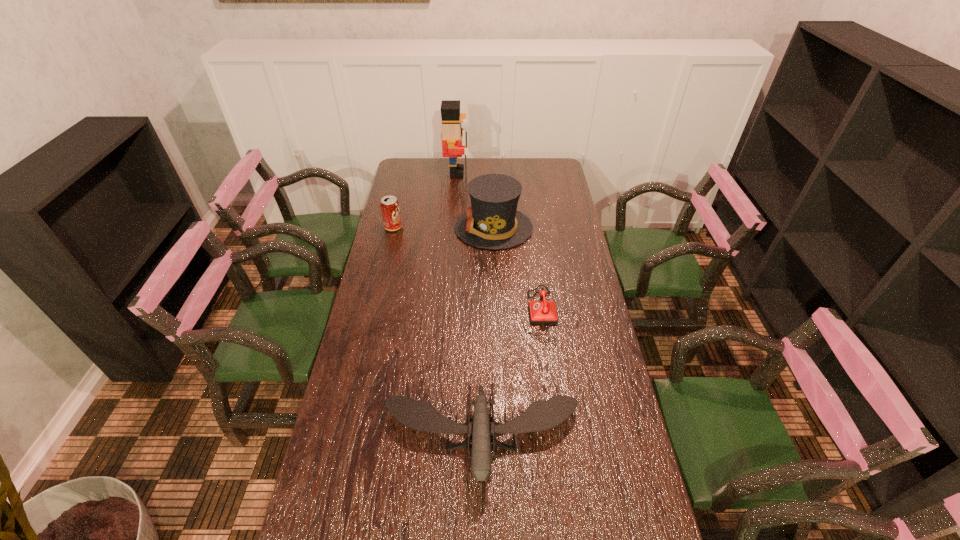
You are a GUI agent. You are given a task and a screenshot of the screen. Output one action in this format:
    pyautogui.click(x=<x>, y=<y>)
    Task: Click on the farthest object
    This screenshot has height=540, width=960.
    Given the screenshot: What is the action you would take?
    pyautogui.click(x=452, y=133)

Identify the location of the tallest object. (452, 133).

This screenshot has height=540, width=960. What are the coordinates of `the fourth shortest object` in the screenshot? It's located at (492, 222).

This screenshot has height=540, width=960. I want to click on the third shortest object, so click(x=390, y=209).

Find the location of a particular element. the leftmost object is located at coordinates (390, 209).

Where is `the nearest object`? the nearest object is located at coordinates (541, 415).

Identify the location of the second shortest object. The width and height of the screenshot is (960, 540). (541, 415).

Where is `telephone`? This screenshot has height=540, width=960. telephone is located at coordinates (541, 312).

Where is `the fourth farthest object`? Image resolution: width=960 pixels, height=540 pixels. the fourth farthest object is located at coordinates (541, 312).

Locate an element on the screen. The image size is (960, 540). free region located in front of the nutcracker holding the staff is located at coordinates (533, 172).